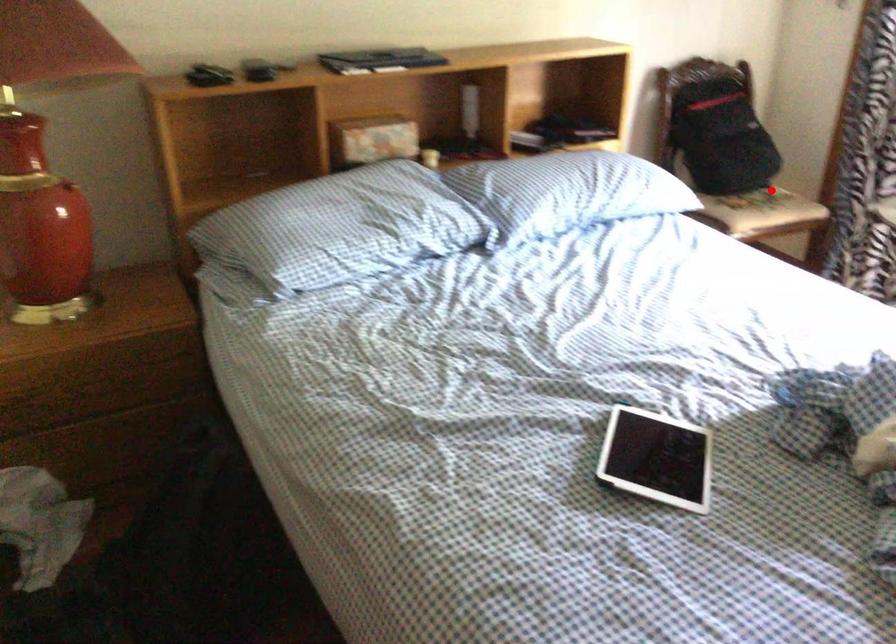
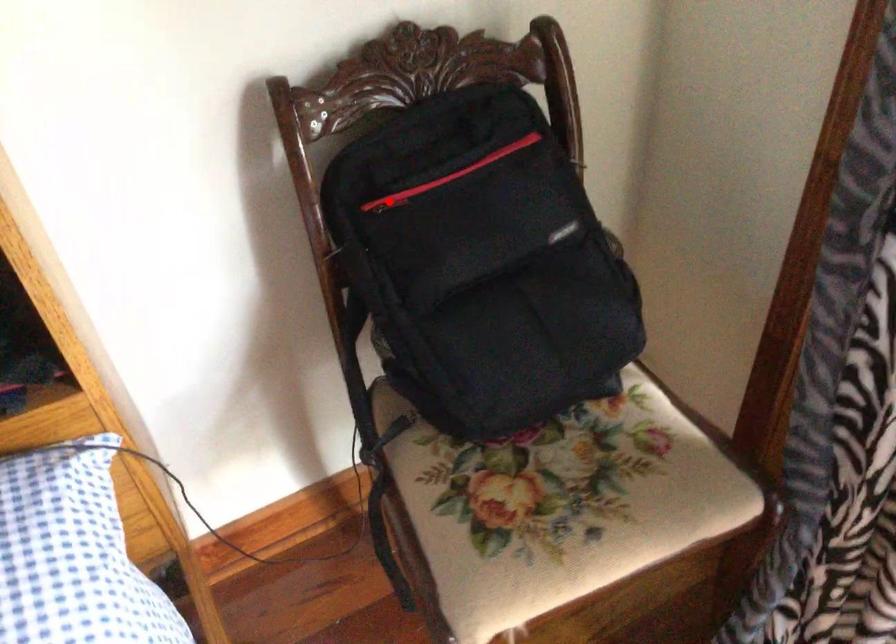
I am providing you with two images of the same scene from different viewpoints. A red point is marked on the first image and another point is marked on the second image. Does the point marked in image1 correspond to the same location as the one in image2?

No